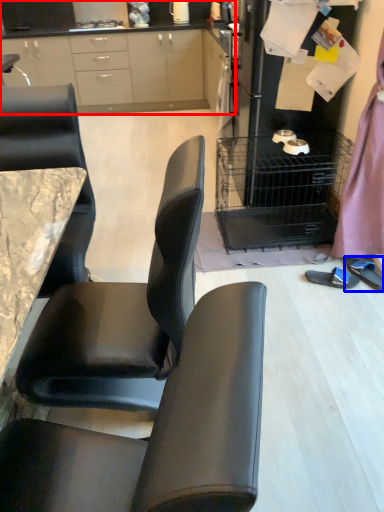
Question: Which object is closer to the camera taking this photo, cabinetry (highlighted by a red box) or footwear (highlighted by a blue box)?

Choices:
 (A) cabinetry
 (B) footwear

Answer: (B)